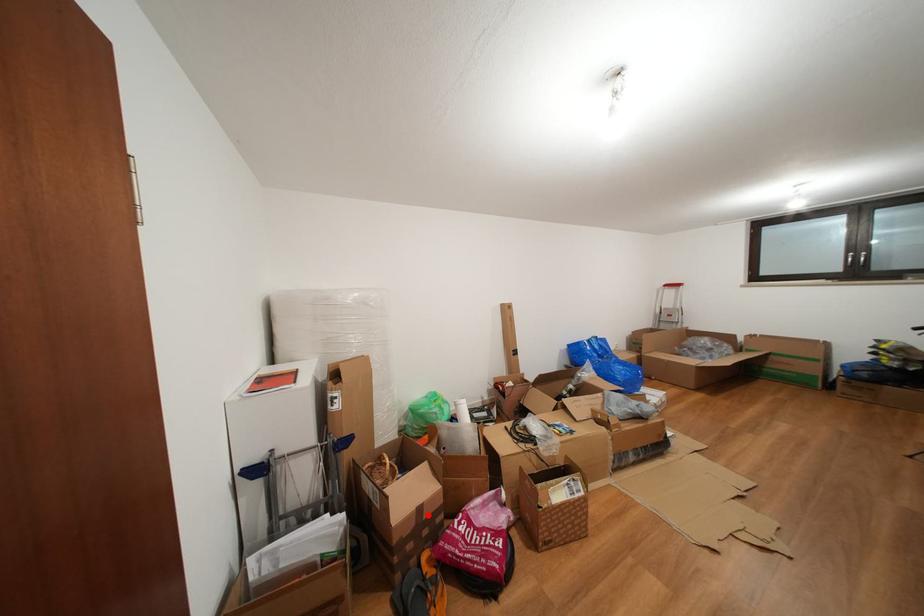
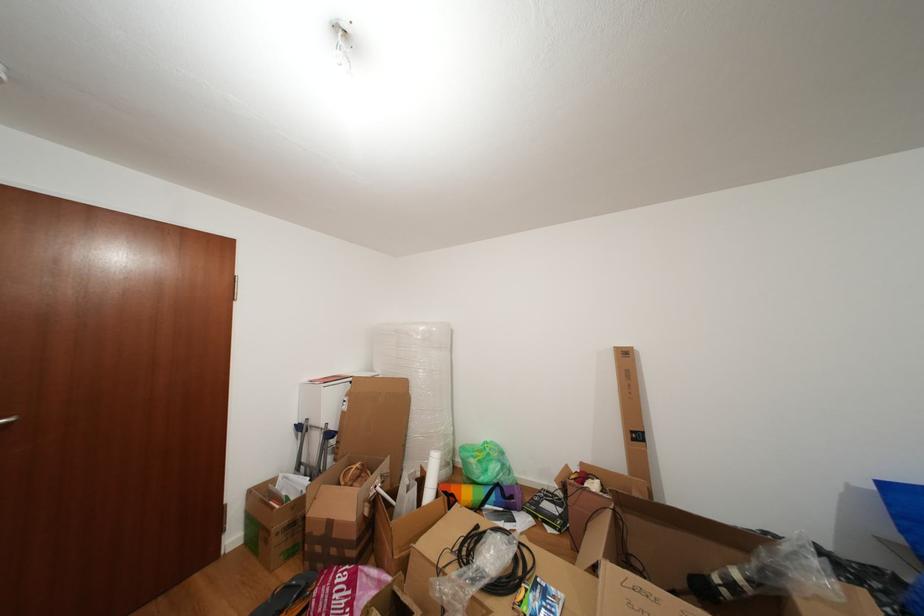
The point at the highlighted location is marked in the first image. Where is the corresponding point in the second image?

(338, 529)